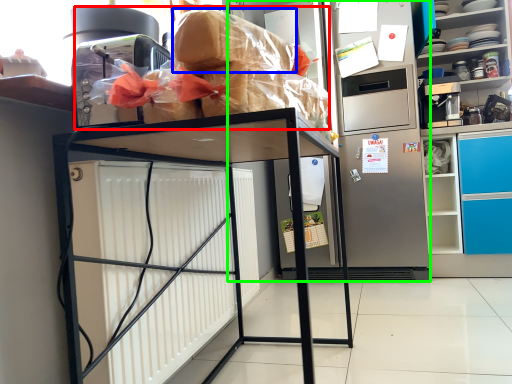
Question: Which object is positioned farthest from stuff (highlighted by a red box)? Select from bread (highlighted by a blue box) and appliance (highlighted by a green box).

Choices:
 (A) bread
 (B) appliance

Answer: (B)